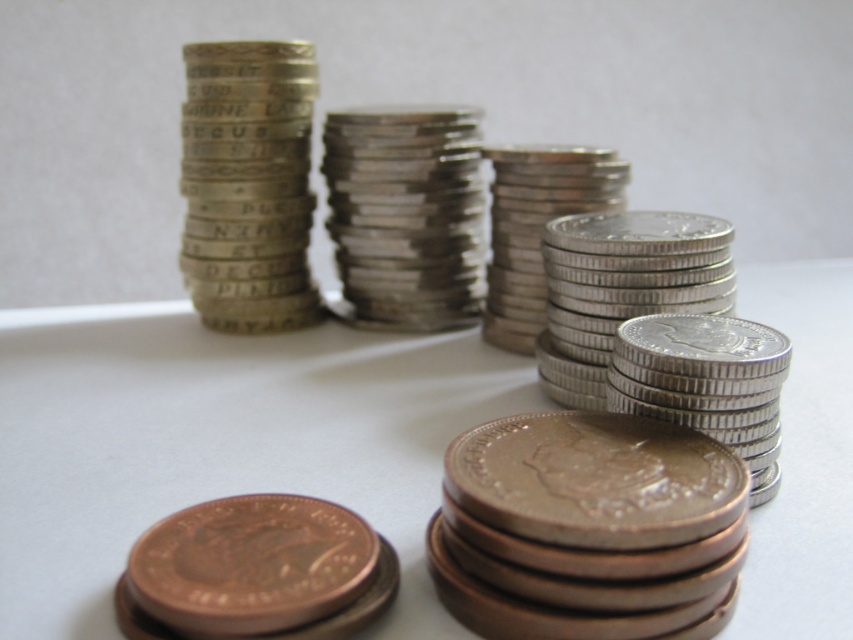
Which is more to the left, bronze metallic coin at lower center or silver metallic coins at center?

silver metallic coins at center

Is bronze metallic coin at lower center positioned in front of silver metallic coins at center?

Yes, it is.

Is point (444, 576) positioned before point (370, 269)?

Yes, point (444, 576) is in front of point (370, 269).

Image resolution: width=853 pixels, height=640 pixels. I want to click on bronze metallic coin at lower center, so click(x=589, y=529).

Does point (264, 221) come in front of point (175, 536)?

No, it is not.

Does point (223, 262) come closer to viewer compared to point (270, 586)?

No.

Identify the location of silver metallic coin at center. This screenshot has height=640, width=853. (247, 182).

Is shiny metallic coins at center shorter than copper-bronze coin at lower left?

No, shiny metallic coins at center is not shorter than copper-bronze coin at lower left.

Between shiny metallic coins at center and copper-bronze coin at lower left, which one is positioned lower?

Positioned lower is copper-bronze coin at lower left.

Is point (784, 461) positioned before point (234, 532)?

No, (784, 461) is further to viewer.

Where is `shiny metallic coins at center`? This screenshot has width=853, height=640. shiny metallic coins at center is located at coordinates (219, 442).